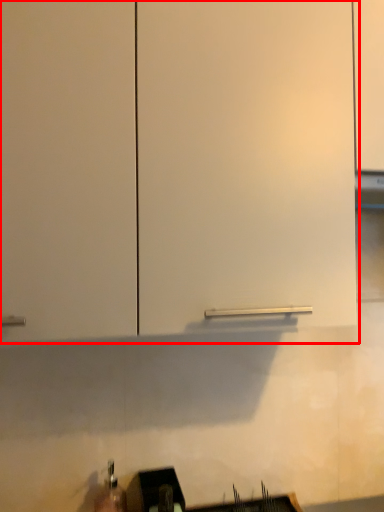
Question: Considering the relative positions of cabinetry (annotated by the red box) and sink in the image provided, where is cabinetry (annotated by the red box) located with respect to the staircase?

Choices:
 (A) right
 (B) left

Answer: (A)